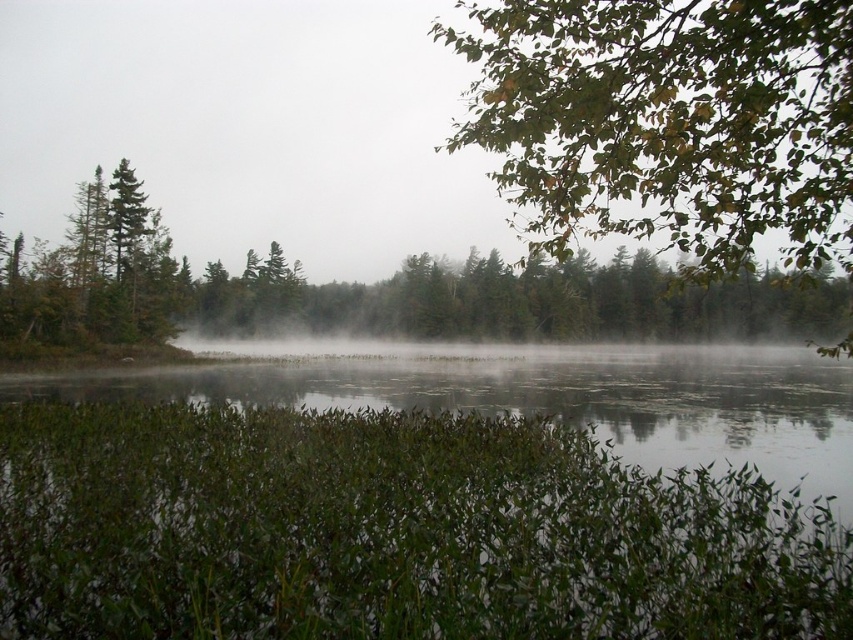
Question: Is green matte tree at upper center bigger than green leafy vegetation at lower center?

Choices:
 (A) no
 (B) yes

Answer: (B)

Question: Which point is farther from the camera taking this photo?

Choices:
 (A) (804, 371)
 (B) (526, 4)
 (C) (821, 320)

Answer: (C)

Question: Which object is closer to the camera taking this photo?

Choices:
 (A) green matte tree at upper center
 (B) green leafy vegetation at lower center

Answer: (A)

Question: Does green leafy branch at upper right have a smaller size compared to green leafy vegetation at lower center?

Choices:
 (A) yes
 (B) no

Answer: (B)

Question: Which point appears farthest from the camera in this image?

Choices:
 (A) (682, 241)
 (B) (231, 330)
 (C) (703, 440)

Answer: (B)

Question: Can you confirm if green leafy branch at upper right is positioned to the left of green matte tree at upper center?

Choices:
 (A) yes
 (B) no

Answer: (B)